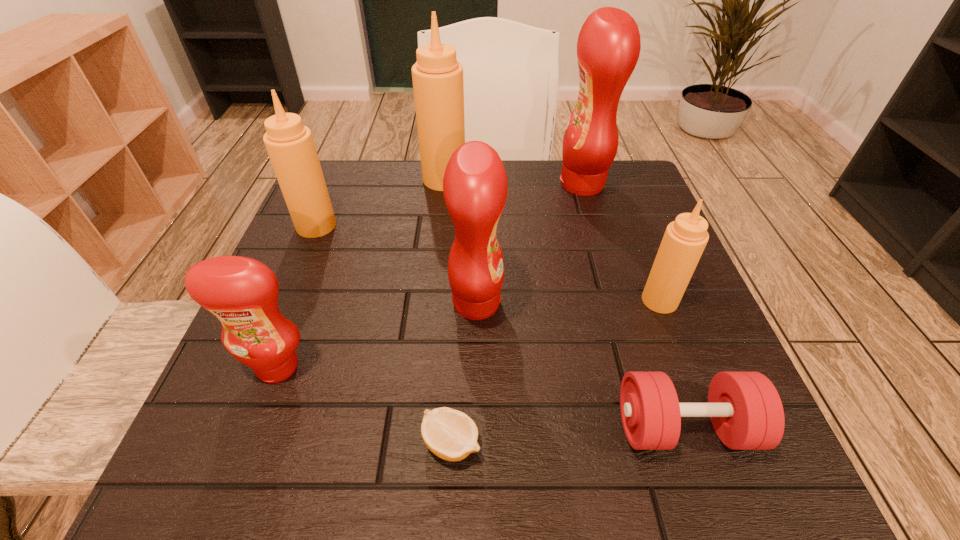
Identify the location of red condiment identified as the second closest to the sixth farthest object. This screenshot has height=540, width=960. (x=608, y=47).

Identify which red condiment is located as the second nearest to the smallest tan condiment. Please provide its 2D coordinates. Your answer should be formatted as a tuple, i.e. [(x, y)], where the tuple contains the x and y coordinates of a point satisfying the conditions above.

[(608, 47)]

The image size is (960, 540). What are the coordinates of `tan condiment that is the closest one to the nearest red condiment` in the screenshot? It's located at (290, 145).

Image resolution: width=960 pixels, height=540 pixels. In order to click on tan condiment that is the third nearest to the smallest red condiment in this screenshot , I will do `click(684, 240)`.

Locate an element on the screen. vacant region that satisfies the following two spatial constraints: 1. on the label side of the rightmost red condiment; 2. on the front side of the yellow lemon is located at coordinates [x=659, y=443].

Locate an element on the screen. The image size is (960, 540). vacant space that satisfies the following two spatial constraints: 1. on the label side of the second red condiment from left to right; 2. on the right side of the dumbbell is located at coordinates (475, 428).

Locate an element on the screen. vacant space that satisfies the following two spatial constraints: 1. on the label side of the rightmost red condiment; 2. on the back side of the dumbbell is located at coordinates click(654, 428).

This screenshot has width=960, height=540. Find the location of `free point that satisfies the following two spatial constraints: 1. on the label side of the nearest condiment; 2. on the left side of the yellow lemon`. free point that satisfies the following two spatial constraints: 1. on the label side of the nearest condiment; 2. on the left side of the yellow lemon is located at coordinates (249, 443).

You are a GUI agent. You are given a task and a screenshot of the screen. Output one action in this format:
    pyautogui.click(x=<x>, y=<y>)
    Task: Click on the free location that satisfies the following two spatial constraints: 1. on the label side of the farthest red condiment; 2. on the left side of the rightmost tan condiment
    Image resolution: width=960 pixels, height=540 pixels.
    Given the screenshot: What is the action you would take?
    pyautogui.click(x=616, y=300)

The height and width of the screenshot is (540, 960). Identify the location of vacant space that satisfies the following two spatial constraints: 1. on the label side of the dumbbell; 2. on the right side of the rightmost red condiment. (654, 428).